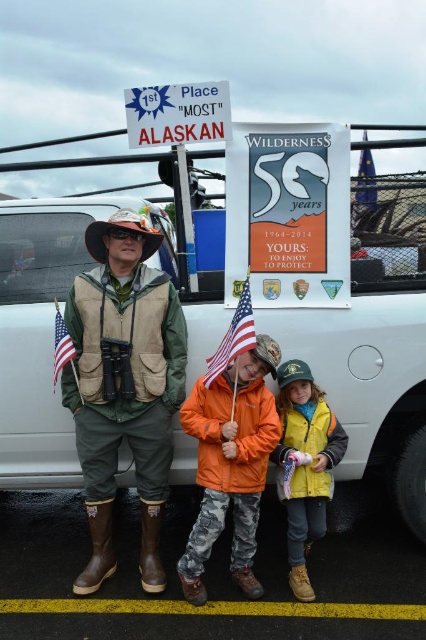
Can you confirm if american flag at center is wider than blue fabric flag at upper right?

Yes.

In the scene shown: Is american flag at center to the left of blue fabric flag at upper right from the viewer's perspective?

Indeed, american flag at center is positioned on the left side of blue fabric flag at upper right.

Does point (207, 371) lie behind point (354, 196)?

No, it is in front of (354, 196).

The height and width of the screenshot is (640, 426). Find the location of `american flag at center`. american flag at center is located at coordinates (233, 337).

Is camouflage fabric vest at left thinner than matte fabric flag at left?

No.

Is point (152, 381) in front of point (57, 332)?

No, (152, 381) is behind (57, 332).

Where is `camouflage fabric vest at left`? The image size is (426, 640). camouflage fabric vest at left is located at coordinates (123, 385).

Is point (357, 467) farther from viewer compared to point (307, 422)?

Yes, it is behind point (307, 422).

Does white matte truck at center have a greater width compared to yellow matte vest at lower center?

Yes, white matte truck at center is wider than yellow matte vest at lower center.

This screenshot has width=426, height=640. What are the coordinates of `white matte truck at center` in the screenshot? It's located at (46, 328).